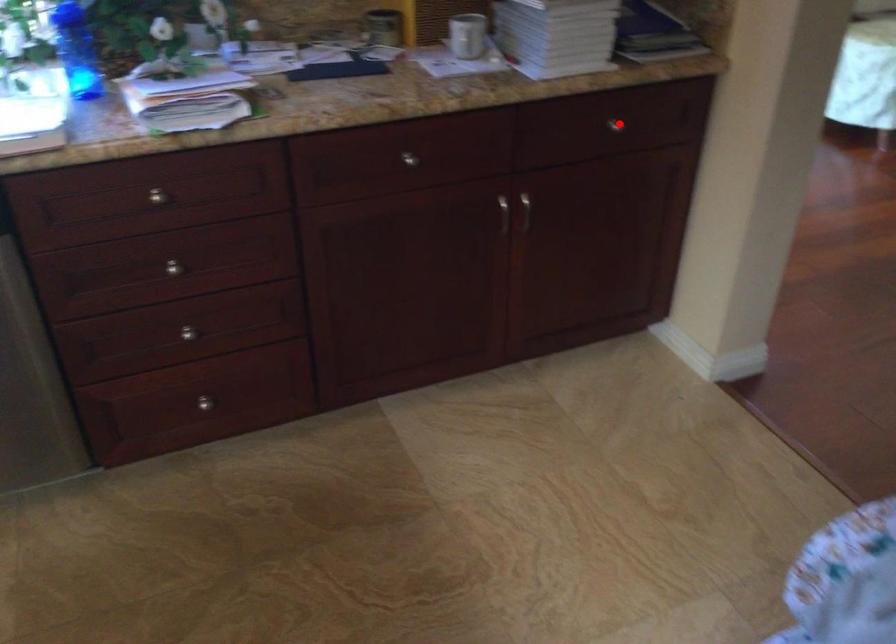
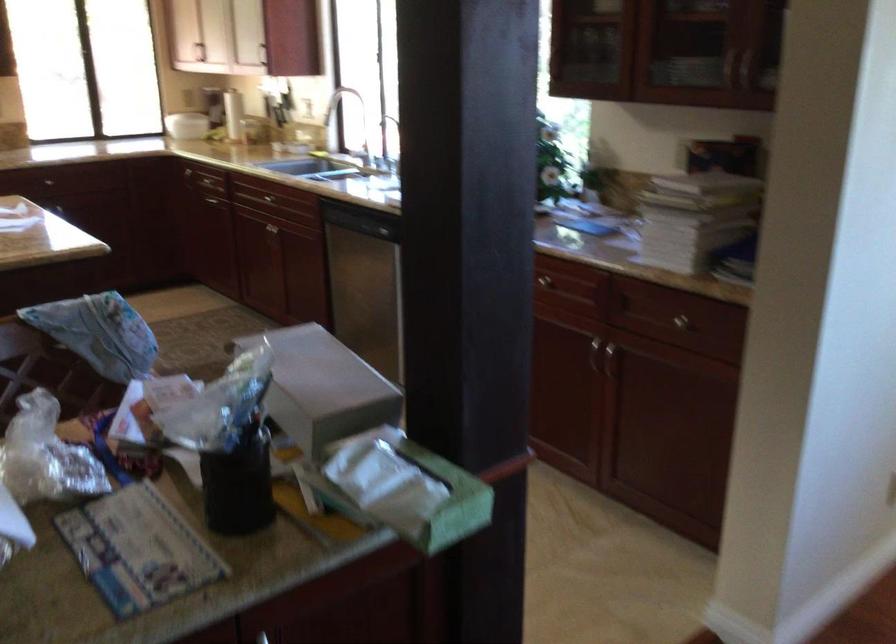
Question: I am providing you with two images of the same scene from different viewpoints. Given a red point in image1, look at the same physical point in image2. Is it:

Choices:
 (A) Closer to the viewpoint
 (B) Farther from the viewpoint

Answer: (B)